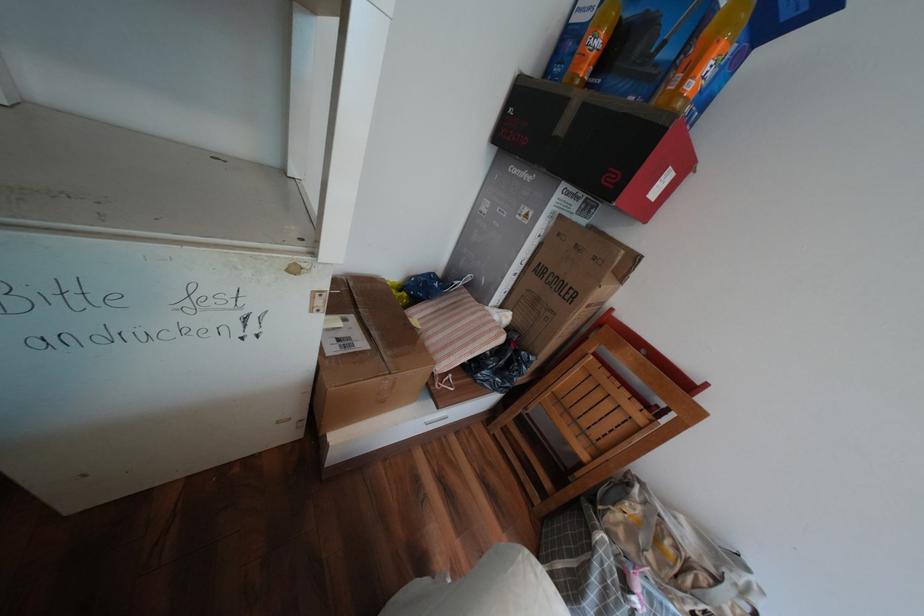
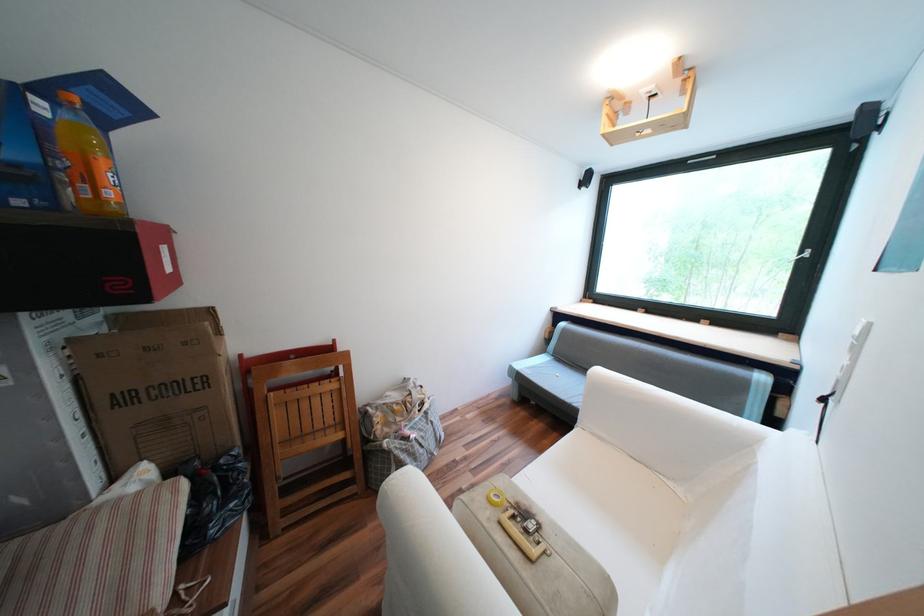
Locate, in the second image, the point that corresponds to point 637,504 in the first image.

(383, 419)